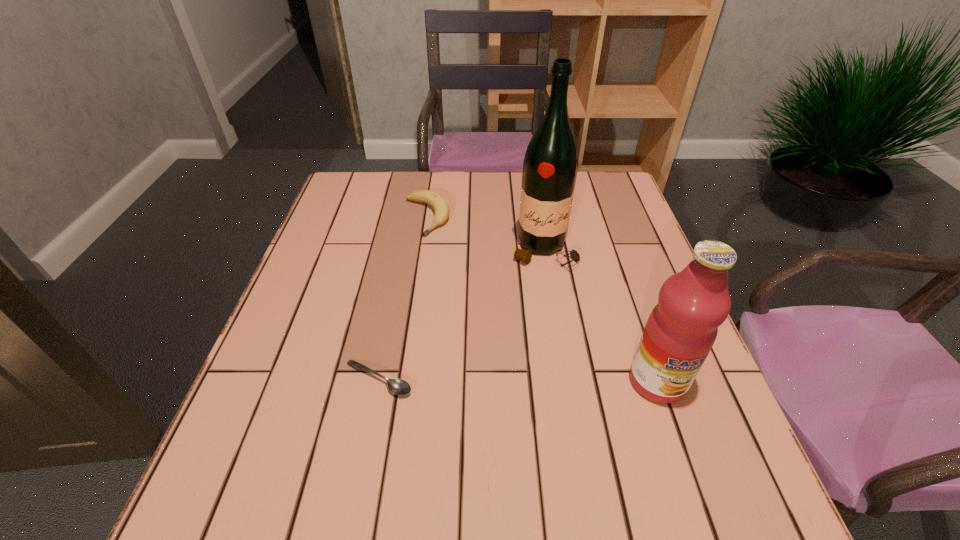
This screenshot has width=960, height=540. Identify the location of soupspoon. coord(396,386).

Locate an element on the screen. This screenshot has width=960, height=540. the rightmost object is located at coordinates (681, 329).

Where is `the second tallest object`? The height and width of the screenshot is (540, 960). the second tallest object is located at coordinates (681, 329).

Image resolution: width=960 pixels, height=540 pixels. What are the coordinates of `the second shortest object` in the screenshot? It's located at (437, 201).

Image resolution: width=960 pixels, height=540 pixels. Identify the location of the second object from right to left. (550, 166).

Image resolution: width=960 pixels, height=540 pixels. What are the coordinates of `the tallest object` in the screenshot? It's located at (550, 166).

Find the location of a particular element. blank area located on the right of the shortest object is located at coordinates (490, 379).

Find the location of `free space located at the stem of the third tallest object`. free space located at the stem of the third tallest object is located at coordinates (450, 265).

Where is `vacant space located at the stem of the third tallest object`? vacant space located at the stem of the third tallest object is located at coordinates (444, 253).

Image resolution: width=960 pixels, height=540 pixels. What are the coordinates of `blank space located 0.070m at the stem of the third tallest object` in the screenshot? It's located at (443, 251).